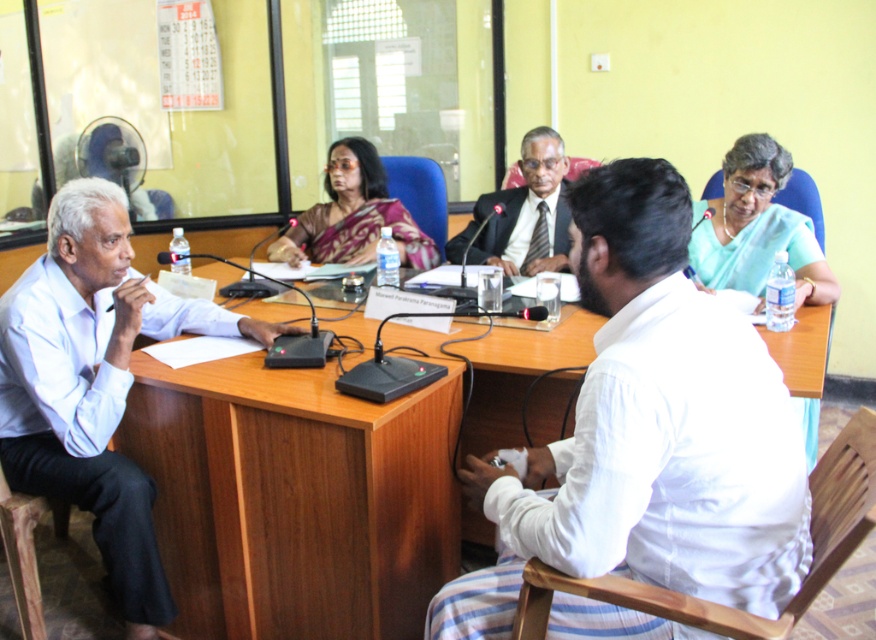
Question: Is light blue shirt at left below matte black suit at center?

Choices:
 (A) no
 (B) yes

Answer: (B)

Question: Among these objects, which one is farthest from the camera?

Choices:
 (A) satin sari at center
 (B) light blue fabric saree at upper right
 (C) white cotton shirt at center
 (D) matte black suit at center

Answer: (A)

Question: Is wooden table at center positioned behind white cotton shirt at center?

Choices:
 (A) no
 (B) yes

Answer: (B)

Question: Which point is farther from the camera taking this photo?

Choices:
 (A) (571, 342)
 (B) (513, 218)
 (C) (55, 429)

Answer: (B)

Question: Estimate the real-world distances between objects in this image. Which object is closer to the wooden table at center?

Choices:
 (A) light blue fabric saree at upper right
 (B) matte black suit at center
 (C) light blue shirt at left
 (D) satin sari at center

Answer: (C)

Question: Can you confirm if wooden table at center is wider than satin sari at center?

Choices:
 (A) yes
 (B) no

Answer: (A)